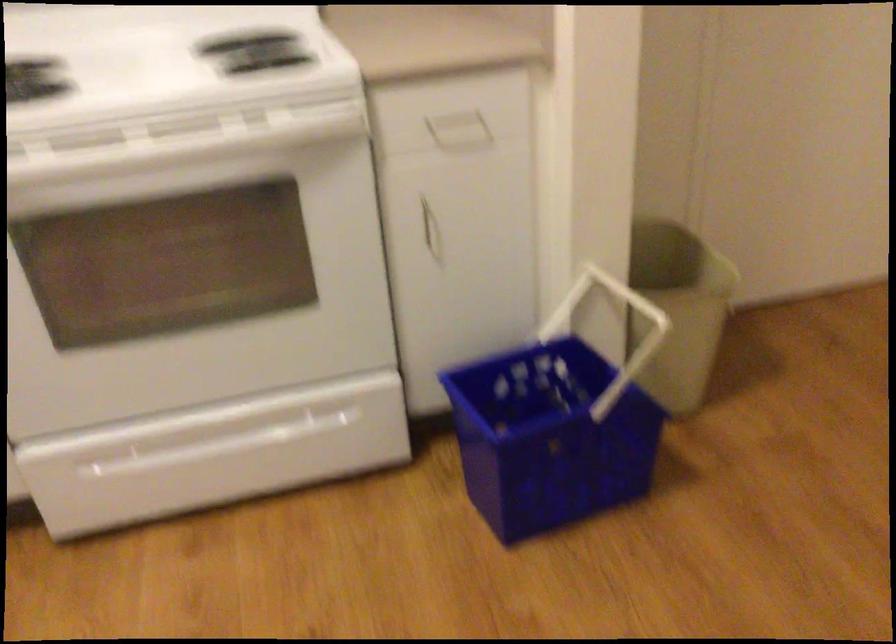
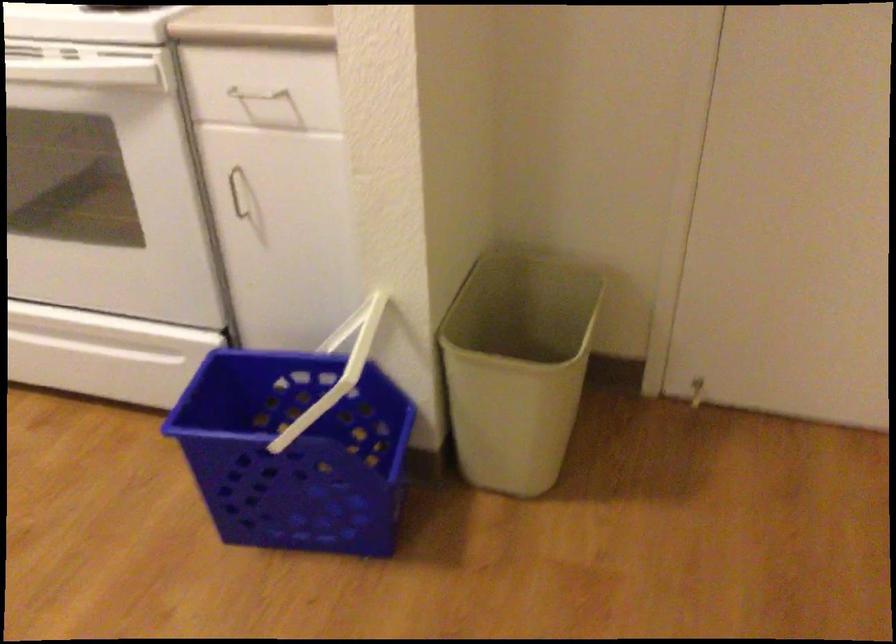
Find the pixel in the second image that matches pixel 271 245 in the first image.

(104, 185)